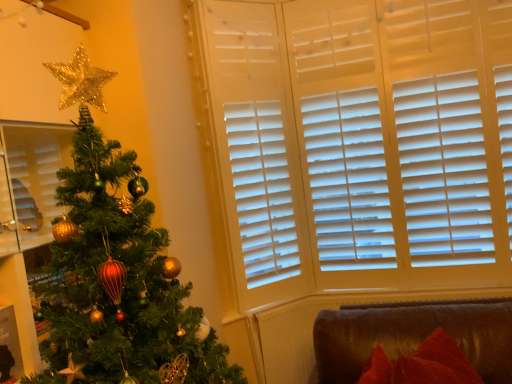
Question: Is velvet red cushion at lower right in contact with shiny green christmas tree at left?

Choices:
 (A) yes
 (B) no

Answer: (B)

Question: Is the position of velvet red cushion at lower right less distant than that of shiny green christmas tree at left?

Choices:
 (A) no
 (B) yes

Answer: (A)

Question: Does velvet red cushion at lower right have a greater width compared to shiny green christmas tree at left?

Choices:
 (A) no
 (B) yes

Answer: (A)

Question: Is velvet red cushion at lower right facing towards shiny green christmas tree at left?

Choices:
 (A) no
 (B) yes

Answer: (A)

Question: Can you confirm if velvet red cushion at lower right is bigger than shiny green christmas tree at left?

Choices:
 (A) yes
 (B) no

Answer: (B)

Question: Is velvet red cushion at lower right facing away from shiny green christmas tree at left?

Choices:
 (A) yes
 (B) no

Answer: (B)

Question: Is shiny green christmas tree at left next to velvet red cushion at lower right?

Choices:
 (A) no
 (B) yes

Answer: (A)

Question: Does shiny green christmas tree at left have a greater height compared to velvet red cushion at lower right?

Choices:
 (A) yes
 (B) no

Answer: (A)

Question: Is shiny green christmas tree at left not within velvet red cushion at lower right?

Choices:
 (A) yes
 (B) no

Answer: (A)

Question: From the image's perspective, is shiny green christmas tree at left on velvet red cushion at lower right?

Choices:
 (A) yes
 (B) no

Answer: (A)

Question: Is shiny green christmas tree at left aimed at velvet red cushion at lower right?

Choices:
 (A) yes
 (B) no

Answer: (B)

Question: Is shiny green christmas tree at left positioned far away from velvet red cushion at lower right?

Choices:
 (A) yes
 (B) no

Answer: (A)

Question: Based on their positions, is velvet red cushion at lower right located to the left or right of shiny green christmas tree at left?

Choices:
 (A) left
 (B) right

Answer: (B)